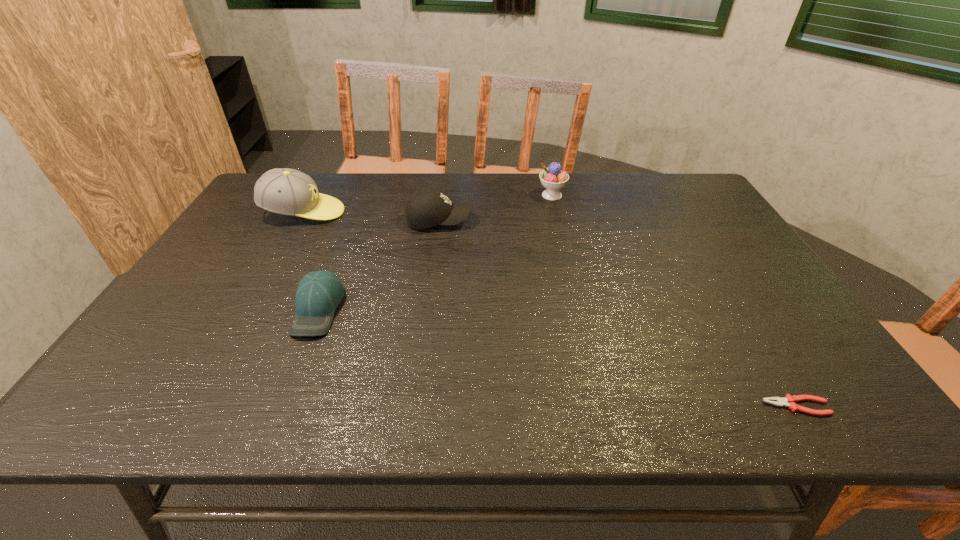
Image resolution: width=960 pixels, height=540 pixels. Find the location of `free space that is in between the tallest object and the rightmost object`. free space that is in between the tallest object and the rightmost object is located at coordinates (550, 309).

Locate an element on the screen. This screenshot has height=540, width=960. empty space between the third shortest object and the tallest baseball cap is located at coordinates 372,217.

The width and height of the screenshot is (960, 540). Find the location of `vacant area between the nearest baseball cap and the rightmost baseball cap`. vacant area between the nearest baseball cap and the rightmost baseball cap is located at coordinates (378, 265).

Identify the location of object that stands as the second closest to the third object from right to left. (552, 178).

The image size is (960, 540). What are the coordinates of `the third closest object to the nearest baseball cap` in the screenshot? It's located at (552, 178).

Locate which baseball cap is the closest to the pliers. Please provide its 2D coordinates. Your answer should be formatted as a tuple, i.e. [(x, y)], where the tuple contains the x and y coordinates of a point satisfying the conditions above.

[(427, 208)]

Where is `baseball cap that is the closest to the second object from right to left`? Image resolution: width=960 pixels, height=540 pixels. baseball cap that is the closest to the second object from right to left is located at coordinates (427, 208).

Where is `free space that satisfies the following two spatial constraints: 1. on the front-facing side of the rightmost object; 2. on the left side of the tallest baseball cap`? The height and width of the screenshot is (540, 960). free space that satisfies the following two spatial constraints: 1. on the front-facing side of the rightmost object; 2. on the left side of the tallest baseball cap is located at coordinates (197, 406).

The height and width of the screenshot is (540, 960). Identify the location of free space that satisfies the following two spatial constraints: 1. on the front-facing side of the tallest baseball cap; 2. on the right side of the nearest object. (197, 406).

Locate an element on the screen. This screenshot has height=540, width=960. free space that satisfies the following two spatial constraints: 1. on the front-facing side of the pliers; 2. on the left side of the tallest object is located at coordinates (197, 406).